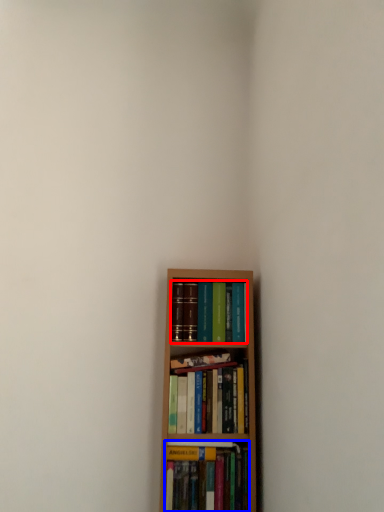
Question: Which object is closer to the camera taking this photo, book (highlighted by a red box) or book (highlighted by a blue box)?

Choices:
 (A) book
 (B) book

Answer: (B)